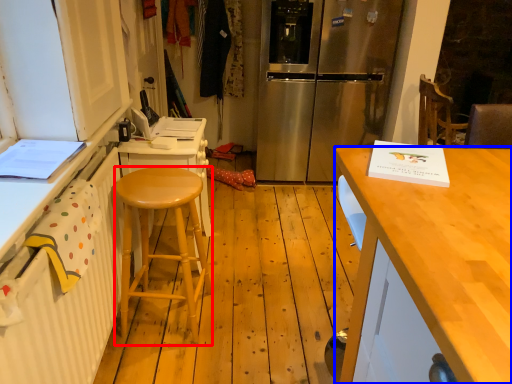
Question: Among these objects, which one is nearest to the camera, stool (highlighted by a red box) or desk (highlighted by a blue box)?

Choices:
 (A) stool
 (B) desk

Answer: (B)